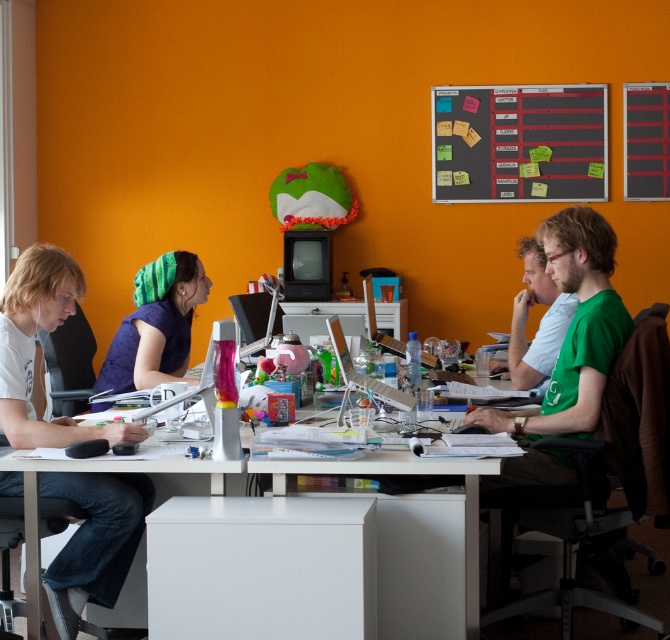
Question: Which point appears closest to the camera in this image?

Choices:
 (A) (533, 381)
 (B) (145, 298)
 (C) (19, 464)

Answer: (C)

Question: Among these objects, which one is nearest to the camera?

Choices:
 (A) green knitted headband at center
 (B) blackboard with sticky notes at upper center
 (C) green matte shirt at right
 (D) green matte shirt at center

Answer: (C)

Question: Is blackboard with sticky notes at upper center below green knitted headband at center?

Choices:
 (A) yes
 (B) no

Answer: (B)

Question: Can you confirm if green matte shirt at right is positioned to the left of white plastic computer desk at center?

Choices:
 (A) yes
 (B) no

Answer: (B)

Question: Among these objects, which one is nearest to the camera?

Choices:
 (A) white plastic computer desk at center
 (B) white t-shirt at left
 (C) green knitted headband at center
 (D) green matte shirt at right

Answer: (A)

Question: Is blackboard with sticky notes at upper center to the right of green matte shirt at right from the viewer's perspective?

Choices:
 (A) no
 (B) yes

Answer: (B)